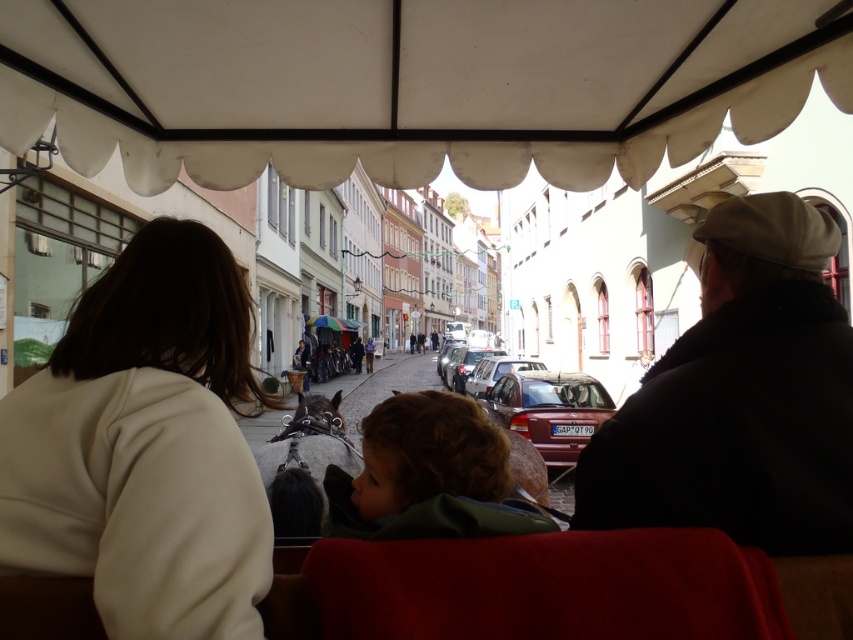
Consider the image. Is beige fleece jacket at left closer to the viewer compared to satin silver car at center?

Yes, it is.

Who is lower down, beige fleece jacket at left or satin silver car at center?

satin silver car at center

Is point (96, 380) positioned behind point (489, 348)?

No, (96, 380) is in front of (489, 348).

Locate an element on the screen. beige fleece jacket at left is located at coordinates (144, 445).

Who is more forward, (428, 538) or (485, 368)?

Point (428, 538) is in front.

Which of these two, brown fuzzy hair at center or metallic silver car at center, stands taller?

brown fuzzy hair at center is taller.

Identify the location of brown fuzzy hair at center. Image resolution: width=853 pixels, height=640 pixels. (428, 476).

Between point (413, 492) and point (456, 362), which one is positioned in front?

Positioned in front is point (413, 492).

Does point (448, 467) lie in front of point (488, 355)?

Yes, it is in front of point (488, 355).

Image resolution: width=853 pixels, height=640 pixels. Find the location of `brown fuzzy hair at center`. brown fuzzy hair at center is located at coordinates (428, 476).